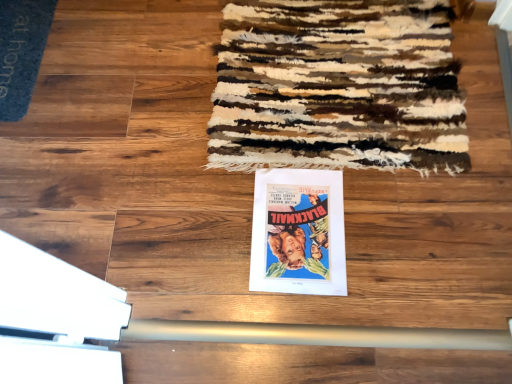
Find the location of a particular element. vacant space in front of textured woolen mat at upper center is located at coordinates (x=362, y=247).